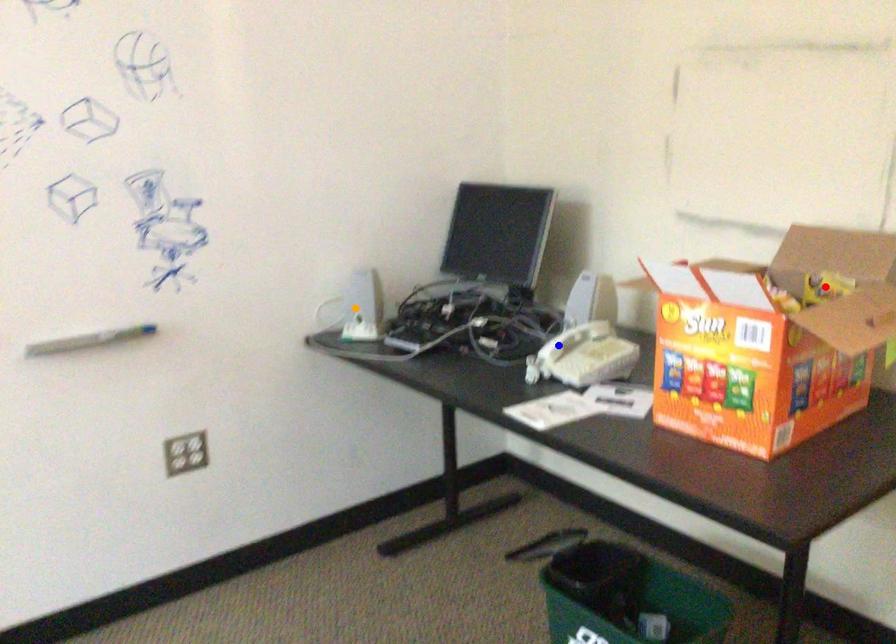
Order these from nearest to farthest:
1. orange point
2. red point
3. blue point

1. red point
2. blue point
3. orange point